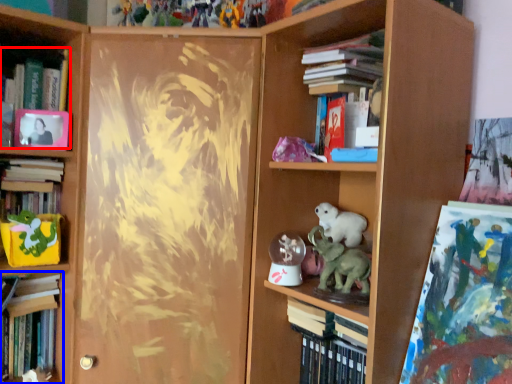
Question: Which point is further to the camera, book (highlighted by a red box) or book (highlighted by a blue box)?

Choices:
 (A) book
 (B) book

Answer: (B)